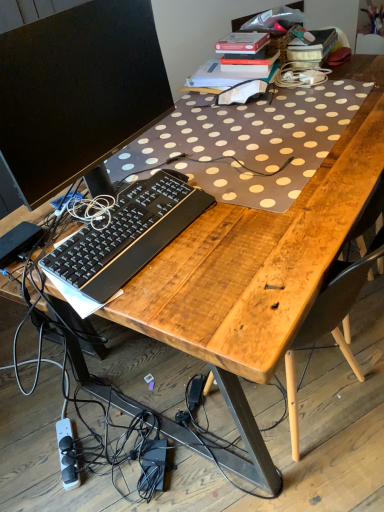
Find the location of a particular element. black plastic keyboard at center is located at coordinates (128, 236).

Measure the distance between black matte computer monitor at upper left and camera.

A distance of 78.08 centimeters exists between black matte computer monitor at upper left and camera.

Identify the location of white plastic power strip at lower left. The image size is (384, 512). (67, 454).

Where is `black plastic keyboard at center`? The height and width of the screenshot is (512, 384). black plastic keyboard at center is located at coordinates (128, 236).

Based on the photo, does black matte computer monitor at upper left have a greater width compared to white plastic power strip at lower left?

No, black matte computer monitor at upper left is not wider than white plastic power strip at lower left.

From a real-world perspective, is black matte computer monitor at upper left physically located above or below white plastic power strip at lower left?

From a real-world perspective, black matte computer monitor at upper left is physically above white plastic power strip at lower left.

From the image's perspective, who appears lower, black matte computer monitor at upper left or white plastic power strip at lower left?

white plastic power strip at lower left is shown below in the image.

Which of these two, black matte computer monitor at upper left or white plastic power strip at lower left, is smaller?

white plastic power strip at lower left is smaller.

Identify the location of equipment on the left of black plastic keyboard at center. (67, 454).

In terms of width, does white plastic power strip at lower left look wider or thinner when compared to black plastic keyboard at center?

Considering their sizes, white plastic power strip at lower left looks broader than black plastic keyboard at center.

From the picture: Is black plastic keyboard at center at the back of white plastic power strip at lower left?

No.

From a real-world perspective, is white plastic power strip at lower left above or below black plastic keyboard at center?

Clearly, from a real-world perspective, white plastic power strip at lower left is below black plastic keyboard at center.

Is black plastic keyboard at center with black matte computer monitor at upper left?

There is a gap between black plastic keyboard at center and black matte computer monitor at upper left.

From the picture: Does black plastic keyboard at center turn towards black matte computer monitor at upper left?

No, black plastic keyboard at center is not turned towards black matte computer monitor at upper left.

Is black plastic keyboard at center bigger than black matte computer monitor at upper left?

No, black plastic keyboard at center is not bigger than black matte computer monitor at upper left.

Is point (118, 245) in front of point (111, 87)?

No.

Is white plastic power strip at lower left turned away from black matte computer monitor at upper left?

No.

Which of these two, white plastic power strip at lower left or black matte computer monitor at upper left, is bigger?

black matte computer monitor at upper left.

Considering the relative sizes of white plastic power strip at lower left and black matte computer monitor at upper left in the image provided, is white plastic power strip at lower left thinner than black matte computer monitor at upper left?

In fact, white plastic power strip at lower left might be wider than black matte computer monitor at upper left.

Is white plastic power strip at lower left positioned far away from black matte computer monitor at upper left?

Yes, white plastic power strip at lower left and black matte computer monitor at upper left are located far from each other.

From the image's perspective, which one is positioned lower, black matte computer monitor at upper left or black plastic keyboard at center?

black plastic keyboard at center.

Considering the sizes of objects black matte computer monitor at upper left and black plastic keyboard at center in the image provided, who is thinner, black matte computer monitor at upper left or black plastic keyboard at center?

black matte computer monitor at upper left is thinner.

Is black matte computer monitor at upper left in front of or behind black plastic keyboard at center in the image?

Clearly, black matte computer monitor at upper left is in front of black plastic keyboard at center.

In the scene shown: Which object is positioned more to the left, black plastic keyboard at center or white plastic power strip at lower left?

Positioned to the left is white plastic power strip at lower left.

From a real-world perspective, which is physically above, black plastic keyboard at center or white plastic power strip at lower left?

black plastic keyboard at center.

Is white plastic power strip at lower left at the back of black plastic keyboard at center?

black plastic keyboard at center is not turned away from white plastic power strip at lower left.

Does black plastic keyboard at center have a smaller size compared to white plastic power strip at lower left?

No.

Find the location of `equipment below the black matte computer monitor at upper left (from a real-world perspective)`. equipment below the black matte computer monitor at upper left (from a real-world perspective) is located at coordinates (67, 454).

You are a GUI agent. You are given a task and a screenshot of the screen. Output one action in this format:
    pyautogui.click(x=<x>, y=<y>)
    Task: Click on the computer keyboard in front of the white plastic power strip at lower left
    This screenshot has width=384, height=512.
    Given the screenshot: What is the action you would take?
    pyautogui.click(x=128, y=236)

When comparing their distances from black matte computer monitor at upper left, does black plastic keyboard at center or white plastic power strip at lower left seem further?

white plastic power strip at lower left is positioned further to the anchor black matte computer monitor at upper left.

Considering their positions, is black matte computer monitor at upper left positioned closer to white plastic power strip at lower left than black plastic keyboard at center?

black plastic keyboard at center is closer to white plastic power strip at lower left.

Considering their positions, is black matte computer monitor at upper left positioned further to black plastic keyboard at center than white plastic power strip at lower left?

Among the two, white plastic power strip at lower left is located further to black plastic keyboard at center.

Considering their positions, is black plastic keyboard at center positioned further to white plastic power strip at lower left than black matte computer monitor at upper left?

black matte computer monitor at upper left.

Looking at the image, which one is located closer to black plastic keyboard at center, white plastic power strip at lower left or black matte computer monitor at upper left?

black matte computer monitor at upper left is positioned closer to the anchor black plastic keyboard at center.

Estimate the real-world distances between objects in this image. Which object is further from black matte computer monitor at upper left, white plastic power strip at lower left or black plastic keyboard at center?

Based on the image, white plastic power strip at lower left appears to be further to black matte computer monitor at upper left.

You are a GUI agent. You are given a task and a screenshot of the screen. Output one action in this format:
    pyautogui.click(x=<x>, y=<y>)
    Task: Click on the computer keyboard between black matte computer monitor at upper left and white plastic power strip at lower left in the up-down direction
    This screenshot has width=384, height=512.
    Given the screenshot: What is the action you would take?
    pyautogui.click(x=128, y=236)